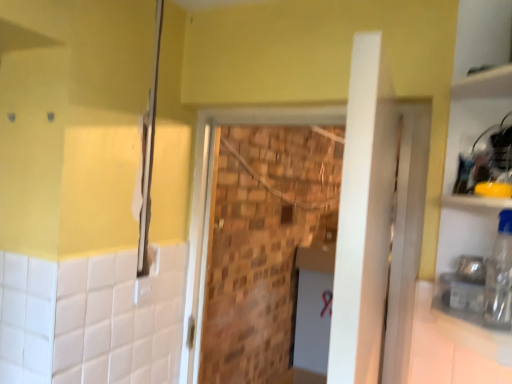
Question: From the image's perspective, is white glossy counter top at lower right above or below transparent plastic bottle at right?

Choices:
 (A) below
 (B) above

Answer: (A)

Question: Choose the correct answer: Is white glossy counter top at lower right inside transparent plastic bottle at right or outside it?

Choices:
 (A) inside
 (B) outside

Answer: (B)

Question: Which of these objects is positioned closest to the matte silver shower at left?

Choices:
 (A) white glossy counter top at lower right
 (B) brick wall at center
 (C) transparent plastic bottle at right

Answer: (B)

Question: Which object is positioned closest to the brick wall at center?

Choices:
 (A) matte silver shower at left
 (B) transparent plastic bottle at right
 (C) white glossy counter top at lower right

Answer: (C)